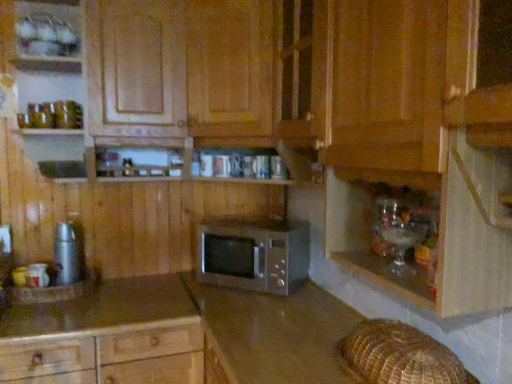
Where is `vacant space situated on the left part of satin silver microwave at center`? The height and width of the screenshot is (384, 512). vacant space situated on the left part of satin silver microwave at center is located at coordinates (167, 292).